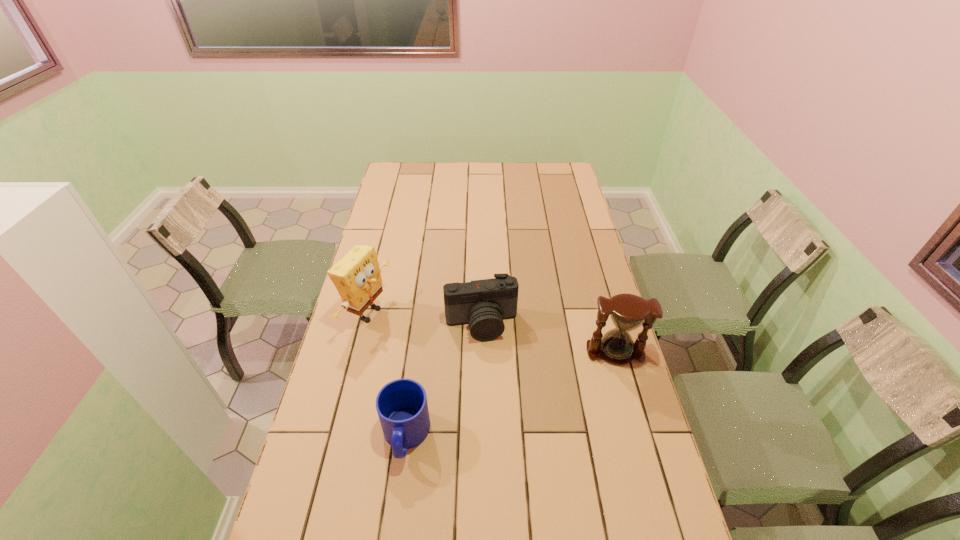
This screenshot has height=540, width=960. Find the location of `the nearest object`. the nearest object is located at coordinates (402, 407).

Find the location of a particular element. The height and width of the screenshot is (540, 960). the second object from left to right is located at coordinates (402, 407).

Find the location of a particular element. hourglass is located at coordinates (x=628, y=312).

Locate an element on the screen. Image resolution: width=960 pixels, height=540 pixels. the second shortest object is located at coordinates (483, 304).

Find the location of a particular element. the third object from left to right is located at coordinates (483, 304).

The height and width of the screenshot is (540, 960). I want to click on sponge, so click(x=357, y=277).

This screenshot has height=540, width=960. I want to click on vacant space positioned on the side with the handle of the nearest object, so click(398, 489).

I want to click on vacant position located 0.170m on the left of the hourglass, so click(533, 352).

Where is `blank space located 0.250m at the lens of the third object from left to right`? The image size is (960, 540). blank space located 0.250m at the lens of the third object from left to right is located at coordinates (502, 413).

The image size is (960, 540). Identify the location of vacant position located 0.120m at the lens of the third object from left to right. (494, 375).